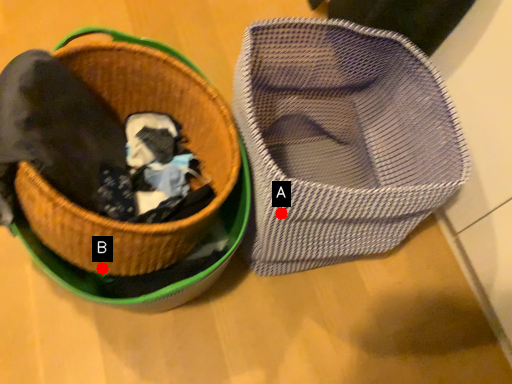
Question: Two points are circled on the image, labeled by A and B beside each circle. Which point is closer to the camera taking this photo?

Choices:
 (A) A is closer
 (B) B is closer

Answer: (A)